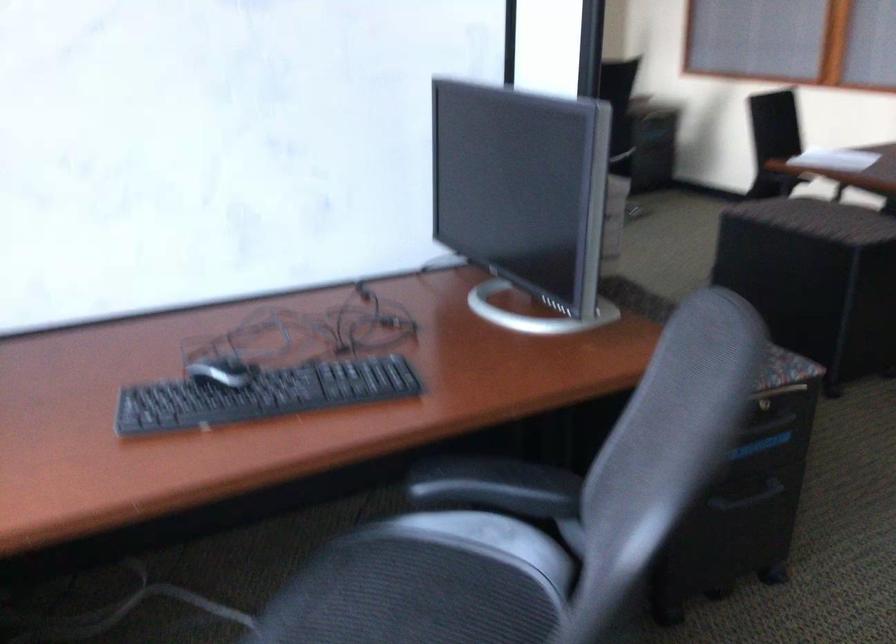
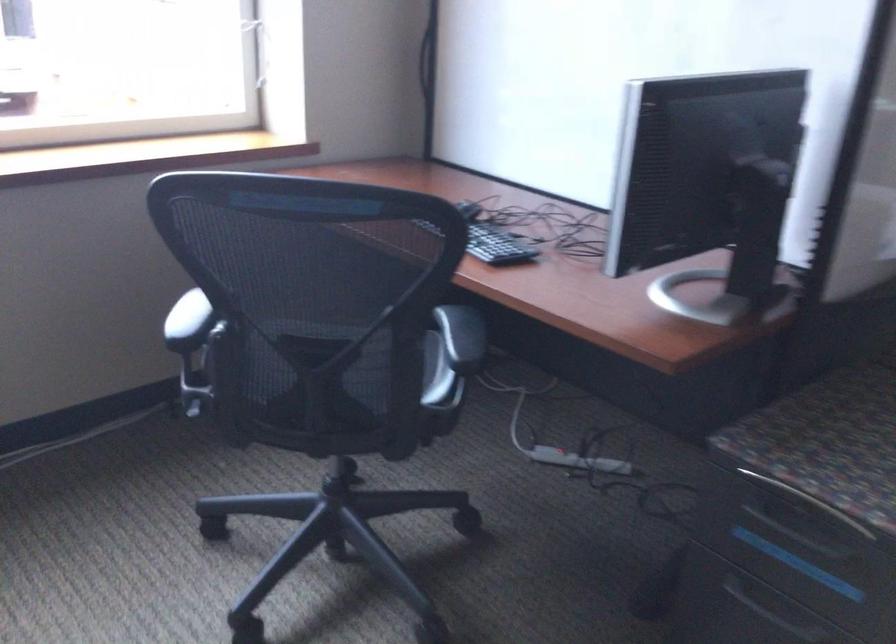
Where in the second image is the point corresponding to [547,480] from the first image?

(461, 337)